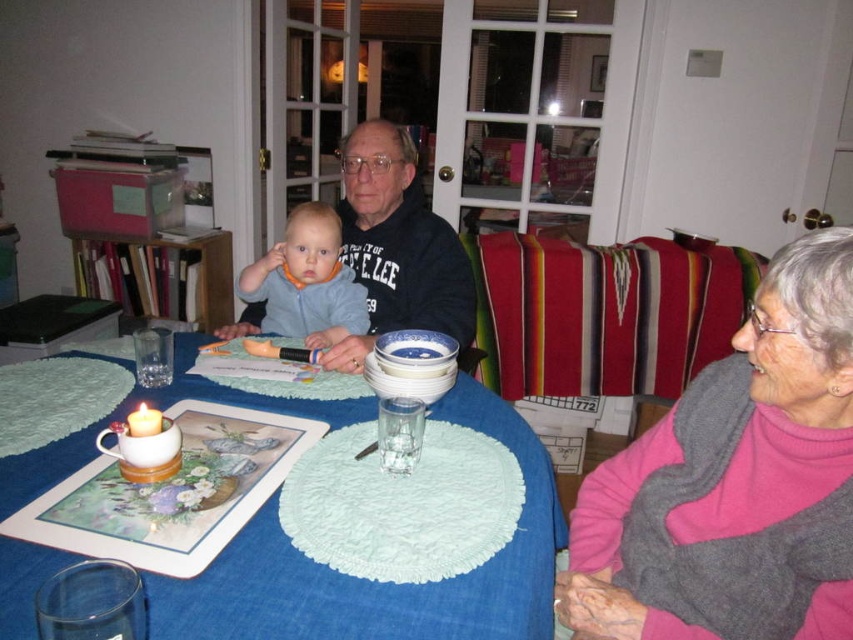
Question: Which object is the farthest from the blue fabric table at center?

Choices:
 (A) matte black sweater at center
 (B) light blue fabric bib at center

Answer: (A)

Question: Which point is farther to the camera?

Choices:
 (A) (457, 314)
 (B) (701, 397)
 (C) (346, 321)

Answer: (A)

Question: Is pink wool sweater at upper right closer to the viewer compared to light blue fabric bib at center?

Choices:
 (A) no
 (B) yes

Answer: (B)

Question: Can you confirm if matte black sweater at center is smaller than light blue fabric bib at center?

Choices:
 (A) no
 (B) yes

Answer: (A)

Question: Considering the relative positions of blue fabric table at center and light blue fabric bib at center in the image provided, where is blue fabric table at center located with respect to light blue fabric bib at center?

Choices:
 (A) right
 (B) left

Answer: (A)

Question: Which of the following is the closest to the observer?

Choices:
 (A) (288, 282)
 (B) (374, 326)
 (C) (618, 454)
 (D) (267, 512)

Answer: (D)